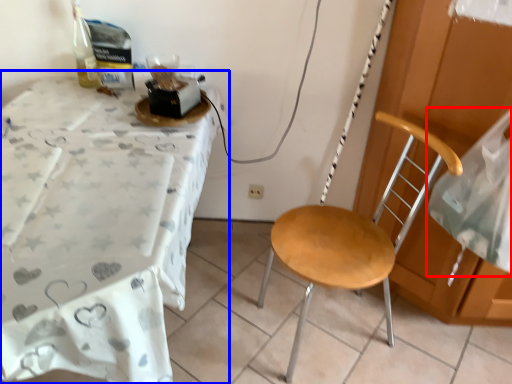
Question: Which object is closer to the camera taking this photo, sheet (highlighted by a red box) or desk (highlighted by a blue box)?

Choices:
 (A) sheet
 (B) desk

Answer: (B)